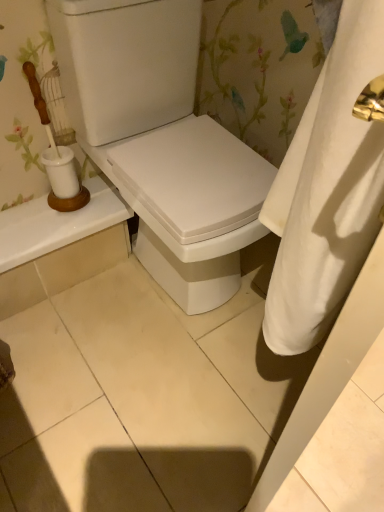
Where is `white glossy toilet at center`? This screenshot has height=512, width=384. white glossy toilet at center is located at coordinates (161, 140).

Describe the element at coordinates (161, 140) in the screenshot. I see `white glossy toilet at center` at that location.

Image resolution: width=384 pixels, height=512 pixels. In order to click on white glossy toilet at center in this screenshot , I will do `click(161, 140)`.